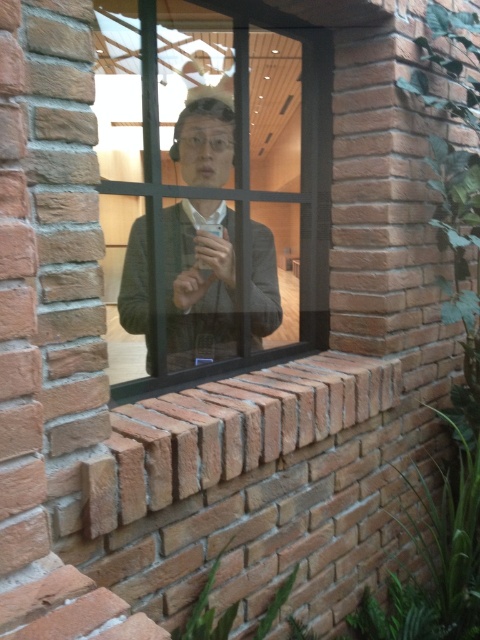
Who is positioned more to the right, clear glass window at center or matte black jacket at center?

clear glass window at center

You are a GUI agent. You are given a task and a screenshot of the screen. Output one action in this format:
    pyautogui.click(x=<x>, y=<y>)
    Task: Click on the clear glass window at center
    Image resolution: width=480 pixels, height=640 pixels.
    Given the screenshot: What is the action you would take?
    pyautogui.click(x=216, y=182)